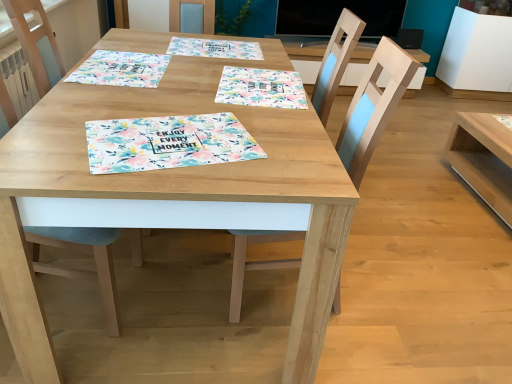
What are the coordinates of `vacant area situated below floral paper placemat at upper center, marked as the second tablecloth in a right-to-left arrangement (from a real-world perspective)` in the screenshot? It's located at (210, 45).